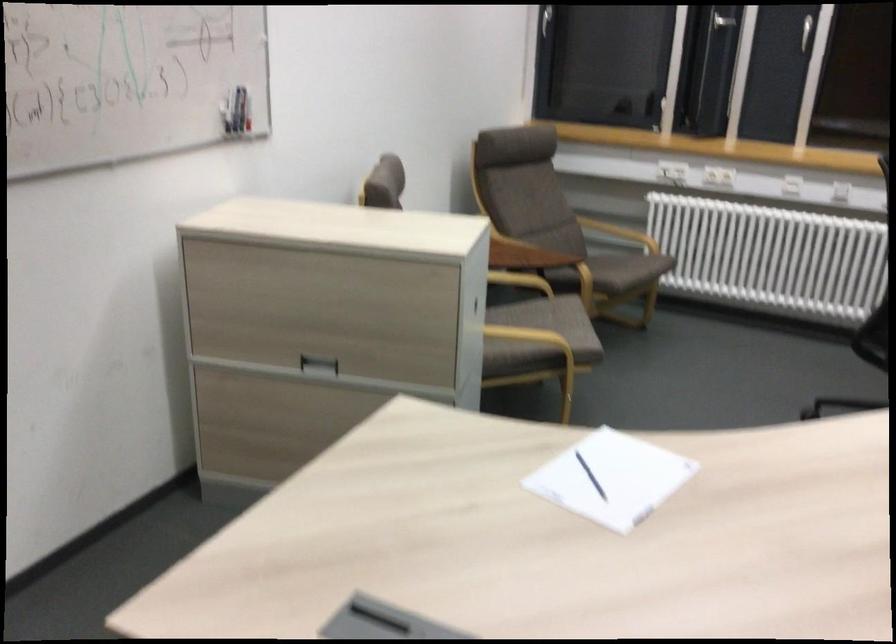
Which object does [228,111] point to?

It corresponds to the blue whiteboard marker in the image.